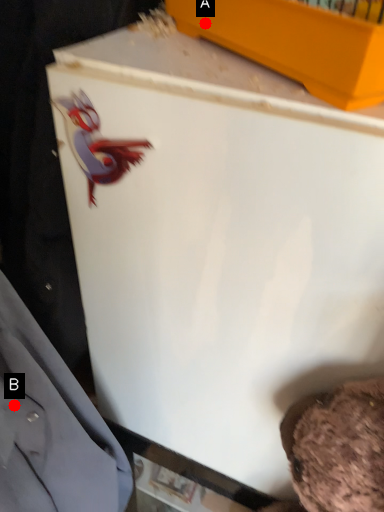
Question: Two points are circled on the image, labeled by A and B beside each circle. Which point is closer to the camera?

Choices:
 (A) A is closer
 (B) B is closer

Answer: (A)